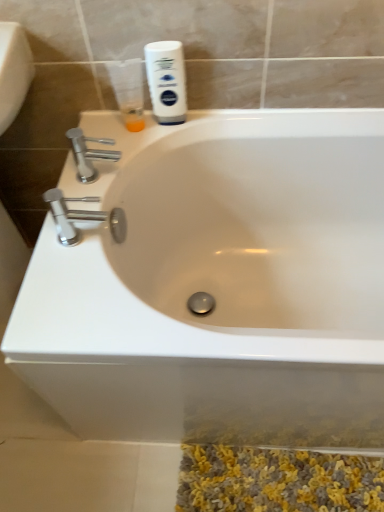
Question: Does white matte shaving cream at upper center have a smaller size compared to polished chrome faucet at upper left, which appears as the first tap when viewed from the top?

Choices:
 (A) no
 (B) yes

Answer: (B)

Question: Can you confirm if white matte shaving cream at upper center is thinner than polished chrome faucet at upper left, marked as the first tap in a back-to-front arrangement?

Choices:
 (A) no
 (B) yes

Answer: (B)

Question: Is white matte shaving cream at upper center turned away from polished chrome faucet at upper left, the 2th tap viewed from the front?

Choices:
 (A) no
 (B) yes

Answer: (A)

Question: From a real-world perspective, is white matte shaving cream at upper center positioned under polished chrome faucet at upper left, which appears as the first tap when viewed from the top, based on gravity?

Choices:
 (A) yes
 (B) no

Answer: (B)

Question: From the image's perspective, would you say white matte shaving cream at upper center is positioned over polished chrome faucet at upper left, marked as the first tap in a back-to-front arrangement?

Choices:
 (A) yes
 (B) no

Answer: (A)

Question: Looking at the image, does translucent plastic cup at upper left seem bigger or smaller compared to white glossy bathtub at center?

Choices:
 (A) big
 (B) small

Answer: (B)

Question: In terms of width, does translucent plastic cup at upper left look wider or thinner when compared to white glossy bathtub at center?

Choices:
 (A) thin
 (B) wide

Answer: (A)

Question: From a real-world perspective, is translucent plastic cup at upper left above or below white glossy bathtub at center?

Choices:
 (A) below
 (B) above

Answer: (B)

Question: Would you say translucent plastic cup at upper left is to the left or to the right of white glossy bathtub at center in the picture?

Choices:
 (A) right
 (B) left

Answer: (B)

Question: Is point (57, 204) positioned closer to the camera than point (172, 96)?

Choices:
 (A) farther
 (B) closer

Answer: (B)

Question: Is chrome metallic faucet at left, acting as the first tap starting from the front, inside the boundaries of white matte shaving cream at upper center, or outside?

Choices:
 (A) outside
 (B) inside

Answer: (A)

Question: Looking at their shapes, would you say chrome metallic faucet at left, marked as the first tap in a bottom-to-top arrangement, is wider or thinner than white matte shaving cream at upper center?

Choices:
 (A) thin
 (B) wide

Answer: (B)

Question: Considering their positions, is chrome metallic faucet at left, the second tap when ordered from top to bottom, located in front of or behind white matte shaving cream at upper center?

Choices:
 (A) behind
 (B) front

Answer: (B)

Question: Considering the positions of point (157, 47) and point (56, 227), is point (157, 47) closer or farther from the camera than point (56, 227)?

Choices:
 (A) farther
 (B) closer

Answer: (A)

Question: From a real-world perspective, is white matte shaving cream at upper center above or below chrome metallic faucet at left, acting as the first tap starting from the front?

Choices:
 (A) below
 (B) above

Answer: (B)